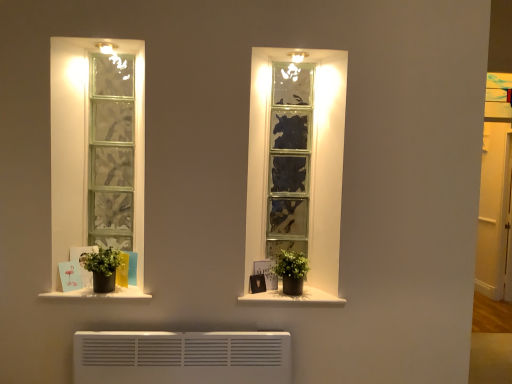
Question: Can you confirm if green matte plant at right, which is the first houseplant from right to left, is thinner than matte black picture frame at center?

Choices:
 (A) no
 (B) yes

Answer: (A)

Question: From the image's perspective, does green matte plant at right, which appears as the second houseplant when viewed from the left, appear higher than matte black picture frame at center?

Choices:
 (A) yes
 (B) no

Answer: (A)

Question: Does green matte plant at right, which is the first houseplant from right to left, come in front of matte black picture frame at center?

Choices:
 (A) yes
 (B) no

Answer: (A)

Question: Can you confirm if green matte plant at right, which appears as the second houseplant when viewed from the left, is smaller than matte black picture frame at center?

Choices:
 (A) no
 (B) yes

Answer: (A)

Question: Is green matte plant at right, which is the first houseplant from right to left, bigger than matte black picture frame at center?

Choices:
 (A) no
 (B) yes

Answer: (B)

Question: Is matte black picture frame at center located within green matte plant at right, which appears as the second houseplant when viewed from the left?

Choices:
 (A) yes
 (B) no

Answer: (B)

Question: Is white matte window sill at center, acting as the 2th window sill starting from the left, at the right side of white matte window sill at lower left, the 1th window sill in the left-to-right sequence?

Choices:
 (A) yes
 (B) no

Answer: (A)

Question: Is white matte window sill at center, marked as the first window sill in a right-to-left arrangement, surrounding white matte window sill at lower left, the 1th window sill in the left-to-right sequence?

Choices:
 (A) no
 (B) yes

Answer: (A)

Question: Considering the relative sizes of white matte window sill at center, marked as the first window sill in a right-to-left arrangement, and white matte window sill at lower left, the 1th window sill in the left-to-right sequence, in the image provided, is white matte window sill at center, marked as the first window sill in a right-to-left arrangement, taller than white matte window sill at lower left, the 1th window sill in the left-to-right sequence,?

Choices:
 (A) no
 (B) yes

Answer: (A)

Question: Does white matte window sill at center, acting as the 2th window sill starting from the left, have a lesser width compared to white matte window sill at lower left, which ranks as the 2th window sill in right-to-left order?

Choices:
 (A) no
 (B) yes

Answer: (B)

Question: Is white matte window sill at center, marked as the first window sill in a right-to-left arrangement, completely or partially outside of white matte window sill at lower left, which ranks as the 2th window sill in right-to-left order?

Choices:
 (A) no
 (B) yes

Answer: (B)

Question: Could you tell me if white matte window sill at center, marked as the first window sill in a right-to-left arrangement, is facing white matte window sill at lower left, which ranks as the 2th window sill in right-to-left order?

Choices:
 (A) no
 (B) yes

Answer: (A)

Question: From the image's perspective, does white matte window sill at lower left, which ranks as the 2th window sill in right-to-left order, appear lower than white matte window sill at center, marked as the first window sill in a right-to-left arrangement?

Choices:
 (A) no
 (B) yes

Answer: (A)